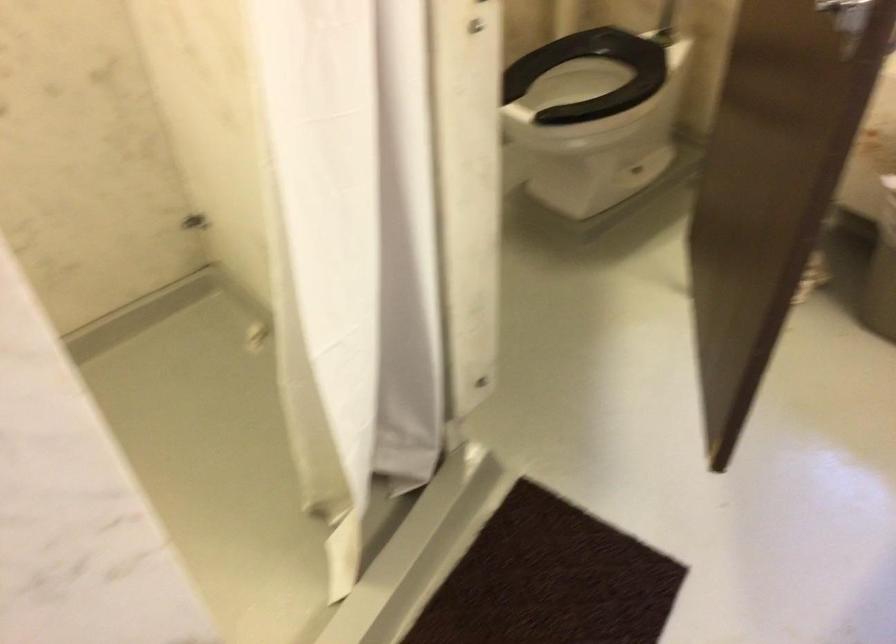
Identify the location of metal door handle. (849, 14).